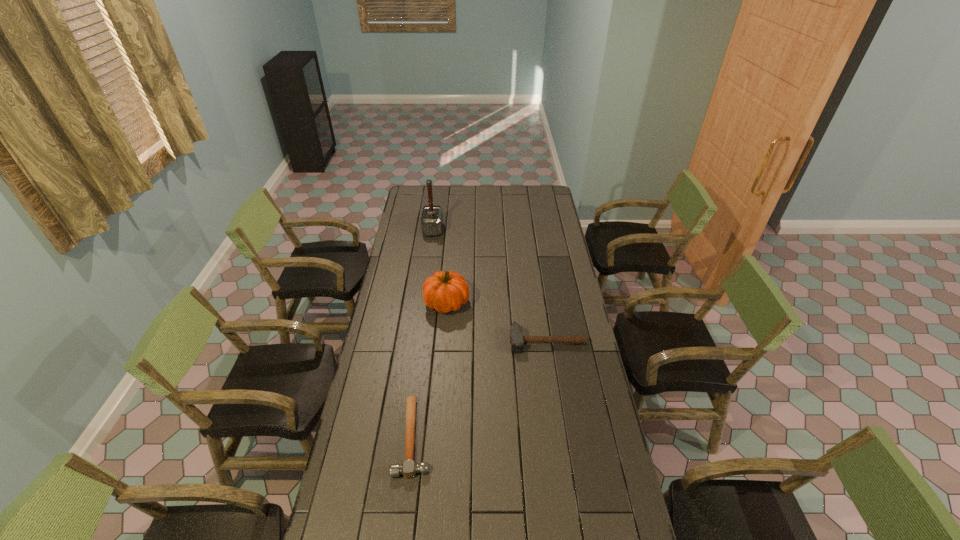
You are a GUI agent. You are given a task and a screenshot of the screen. Output one action in this format:
    pyautogui.click(x=<x>, y=<y>)
    Task: Click on the empty space that is in between the shortest object and the tallest hammer
    This screenshot has height=540, width=960.
    Given the screenshot: What is the action you would take?
    pyautogui.click(x=423, y=333)

Locate an element on the screen. The width and height of the screenshot is (960, 540). empty location between the pumpkin and the second nearest object is located at coordinates (x=497, y=322).

Locate an element on the screen. The image size is (960, 540). vacant region between the shortest object and the farthest object is located at coordinates (423, 333).

This screenshot has height=540, width=960. Identify the location of free point between the third nearest object and the third farthest object. (497, 322).

This screenshot has height=540, width=960. Identify the location of free space between the pumpkin and the farthest object. click(x=440, y=266).

I want to click on unoccupied position between the shortest hammer and the farthest object, so click(x=423, y=333).

Identify the location of free space that is in between the tallest object and the shortest object. (423, 333).

Locate an element on the screen. The width and height of the screenshot is (960, 540). object that is the third nearest to the tallest hammer is located at coordinates (409, 468).

Where is `object that is the third closest to the tallest object`? object that is the third closest to the tallest object is located at coordinates (409, 468).

Locate which hammer ranks third in proximity to the pumpkin. Please provide its 2D coordinates. Your answer should be formatted as a tuple, i.e. [(x, y)], where the tuple contains the x and y coordinates of a point satisfying the conditions above.

[(432, 217)]